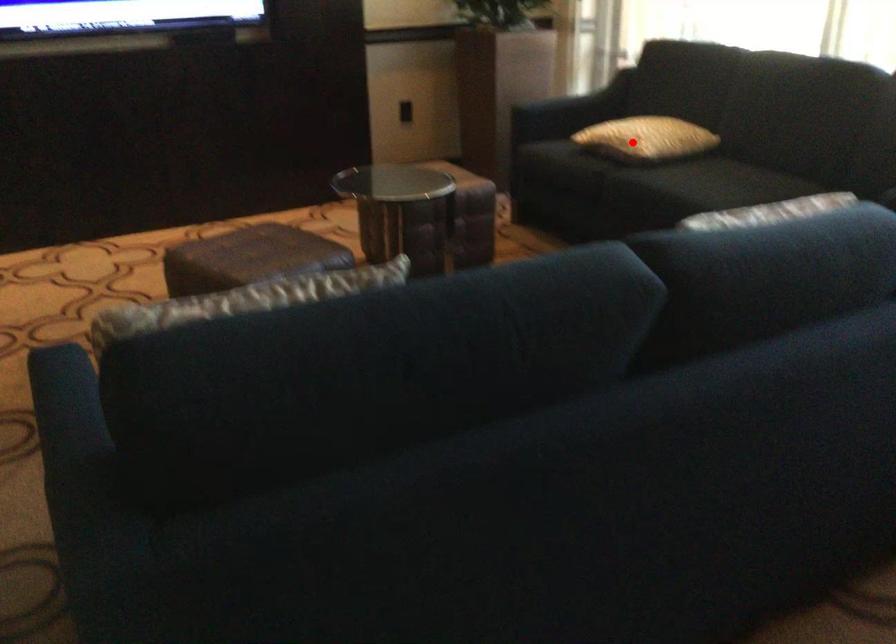
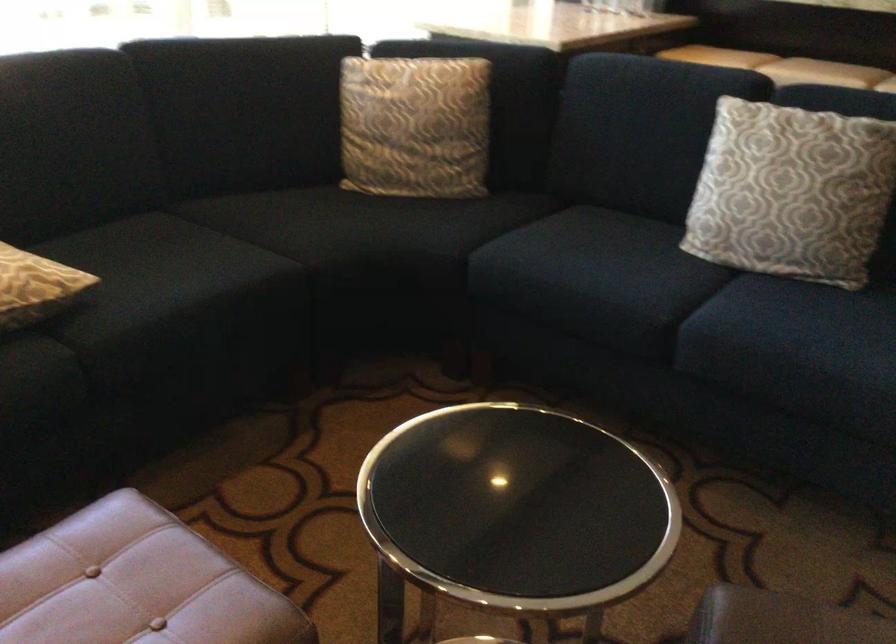
Question: I am providing you with two images of the same scene from different viewpoints. A red point is marked on the first image. Can you still see the location of the red point in image 2?

Choices:
 (A) Yes
 (B) No

Answer: (A)